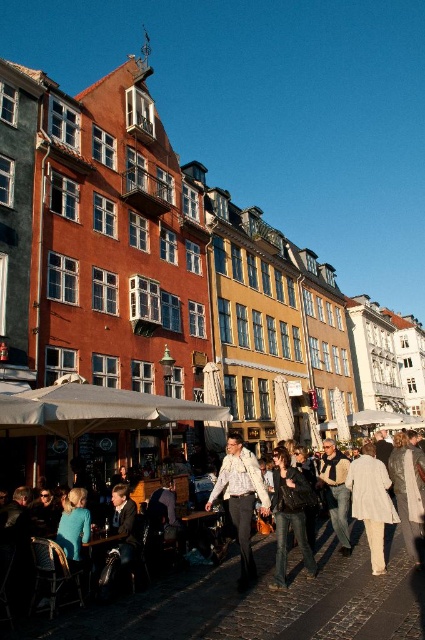
Who is higher up, light beige fabric coat at center or denim jeans at center?

Positioned higher is light beige fabric coat at center.

Is point (351, 493) less distant than point (309, 573)?

No, it is not.

You are a GUI agent. You are given a task and a screenshot of the screen. Output one action in this format:
    pyautogui.click(x=<x>, y=<y>)
    Task: Click on the light beige fabric coat at center
    The width and height of the screenshot is (425, 640).
    Given the screenshot: What is the action you would take?
    pyautogui.click(x=371, y=500)

Which of these two, denim jacket at lower center or white textured shirt at center, stands shorter?

Result: denim jacket at lower center

Can you confirm if denim jacket at lower center is thinner than white textured shirt at center?

Incorrect, denim jacket at lower center's width is not less than white textured shirt at center's.

Which is in front, point (422, 616) or point (229, 445)?

Positioned in front is point (422, 616).

Locate an element on the screen. denim jacket at lower center is located at coordinates pyautogui.click(x=280, y=598).

The height and width of the screenshot is (640, 425). Identify the location of light beige fabric coat at center. (371, 500).

Describe the element at coordinates (371, 500) in the screenshot. This screenshot has height=640, width=425. I see `light beige fabric coat at center` at that location.

Between point (362, 465) and point (337, 486), which one is positioned in front?

Point (362, 465) is in front.

Find the location of a particular element. light beige fabric coat at center is located at coordinates (371, 500).